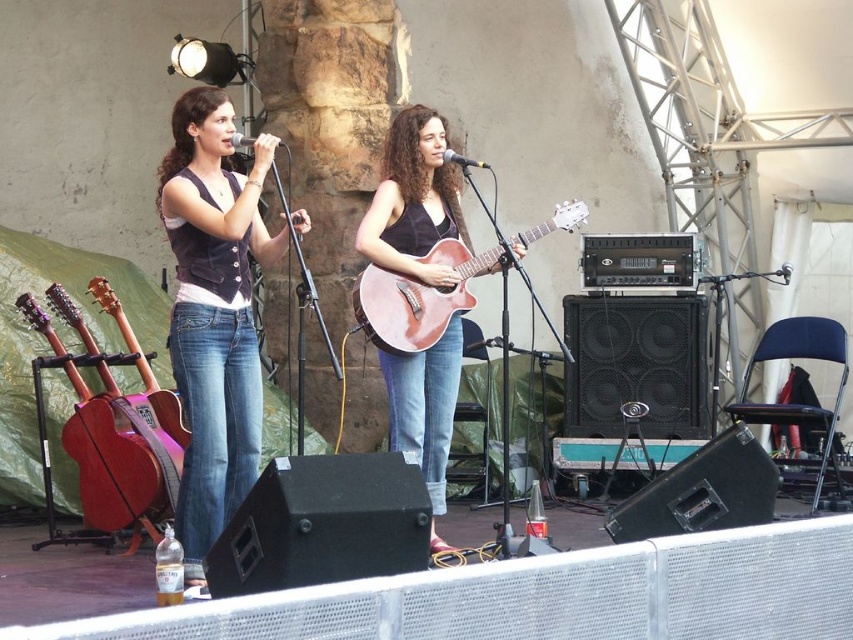
You are a stagehand who needs to adjust the height of the music stands for the performers. The singer is using the matte brown guitar at center and the guitarist is using the matte brown acoustic guitar at left. Which performer will need a taller music stand to accommodate their instrument?

The singer using the matte brown guitar at center will need a taller music stand because the matte brown guitar at center is much taller than the matte brown acoustic guitar at left.

You are a photographer at the event and want to capture a photo where both the denim jeans at center and the matte brown acoustic guitar at left are visible. Considering their heights, which object should you focus on first to ensure they are both in frame?

The denim jeans at center is taller than the matte brown acoustic guitar at left, so you should focus on positioning the denim jeans at center first to ensure both are in frame.